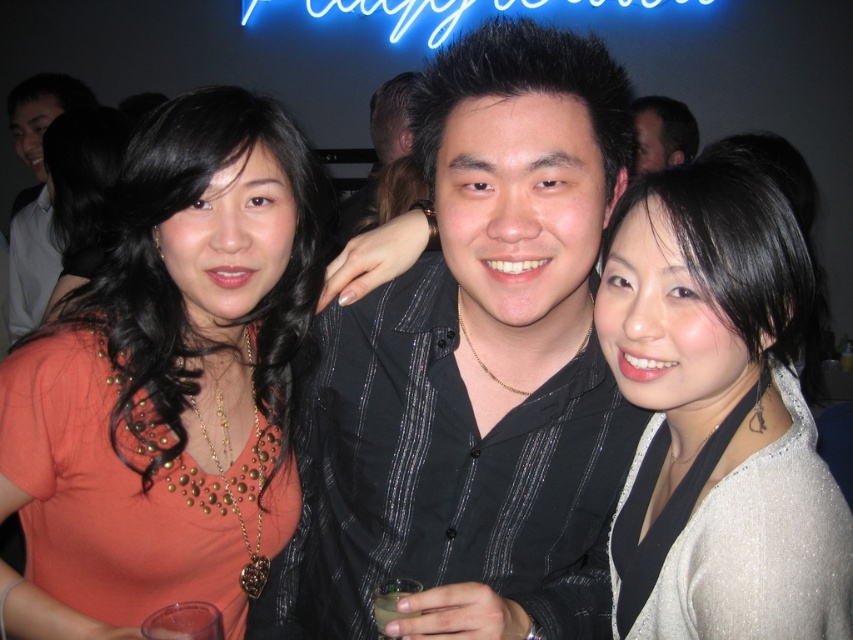
In the scene shown: Between black striped shirt at center and matte black shirt at upper center, which one appears on the left side from the viewer's perspective?

black striped shirt at center

In the scene shown: Does black striped shirt at center have a smaller size compared to matte black shirt at upper center?

Incorrect, black striped shirt at center is not smaller in size than matte black shirt at upper center.

Between point (532, 364) and point (647, 115), which one is positioned behind?

The point (647, 115) is behind.

Identify the location of black striped shirt at center. This screenshot has width=853, height=640. (474, 371).

Can you confirm if satin silver blouse at right is smaller than matte black shirt at upper center?

Indeed, satin silver blouse at right has a smaller size compared to matte black shirt at upper center.

The height and width of the screenshot is (640, 853). I want to click on satin silver blouse at right, so click(718, 416).

Can you confirm if orange fabric shirt at center is positioned to the right of satin silver blouse at right?

Incorrect, orange fabric shirt at center is not on the right side of satin silver blouse at right.

The width and height of the screenshot is (853, 640). What do you see at coordinates (167, 381) in the screenshot?
I see `orange fabric shirt at center` at bounding box center [167, 381].

Find the location of a particular element. The image size is (853, 640). orange fabric shirt at center is located at coordinates [x=167, y=381].